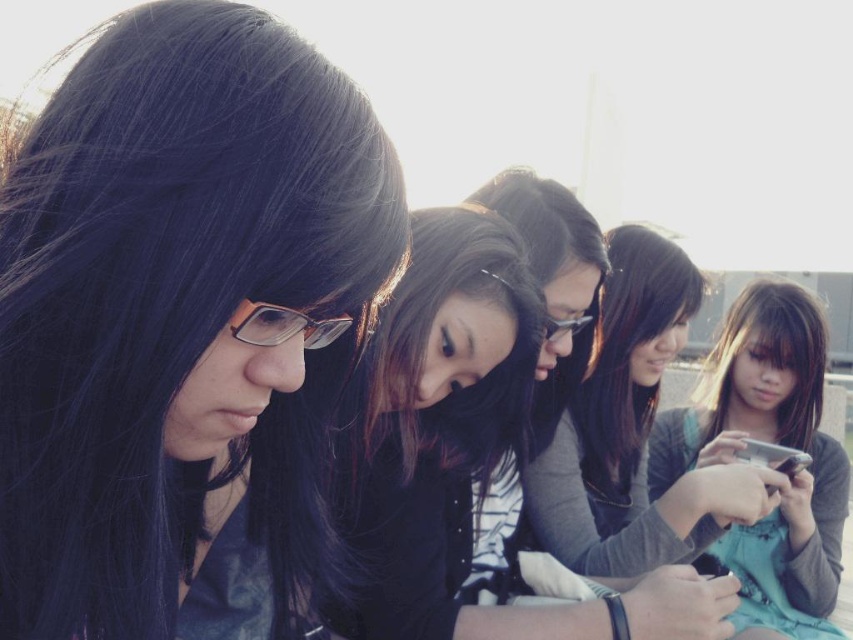
Looking at the scene, where is the dark matte hair at center in relation to the dark brown silky hair at lower right?

The dark matte hair at center is to the left of dark brown silky hair at lower right.

You are a photographer trying to capture a closeup of the dark brown silky hair at lower right without including the dark matte hair at center in the frame. Based on their positions, is this possible?

The dark matte hair at center is closer to the viewer than dark brown silky hair at lower right, so it would block the view of the dark brown silky hair at lower right. Therefore, capturing a closeup of the dark brown silky hair at lower right without including the dark matte hair at center is not possible.

You are taking a photo of the group and notice the teal fabric dress at center and the matte silver phone at lower right. Which object is positioned more to the right side of the image?

The teal fabric dress at center is positioned more to the right side of the image than the matte silver phone at lower right.